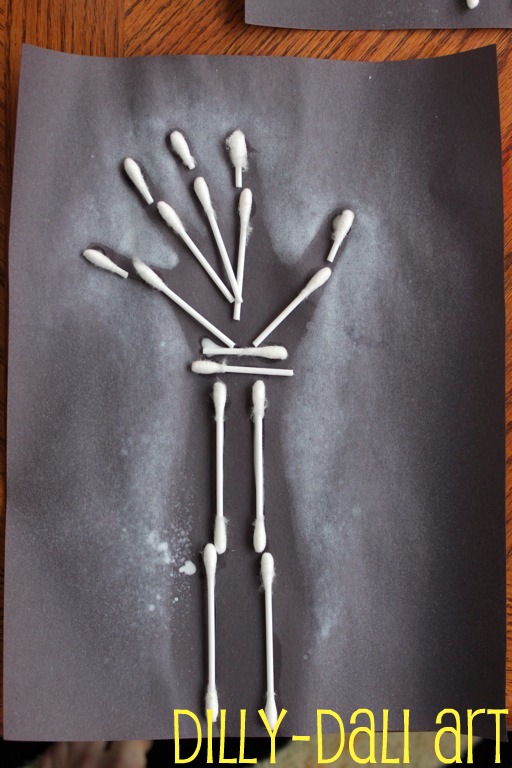
Image resolution: width=512 pixels, height=768 pixels. Identify the location of cotton swab ends. (97, 256), (132, 169), (183, 144), (234, 138), (343, 223).